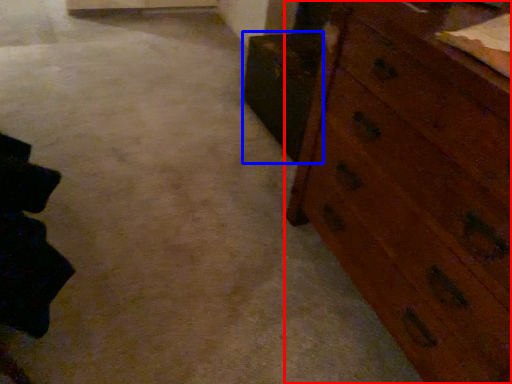
Question: Among these objects, which one is farthest to the camera, chest of drawers (highlighted by a red box) or cabinetry (highlighted by a blue box)?

Choices:
 (A) chest of drawers
 (B) cabinetry

Answer: (B)